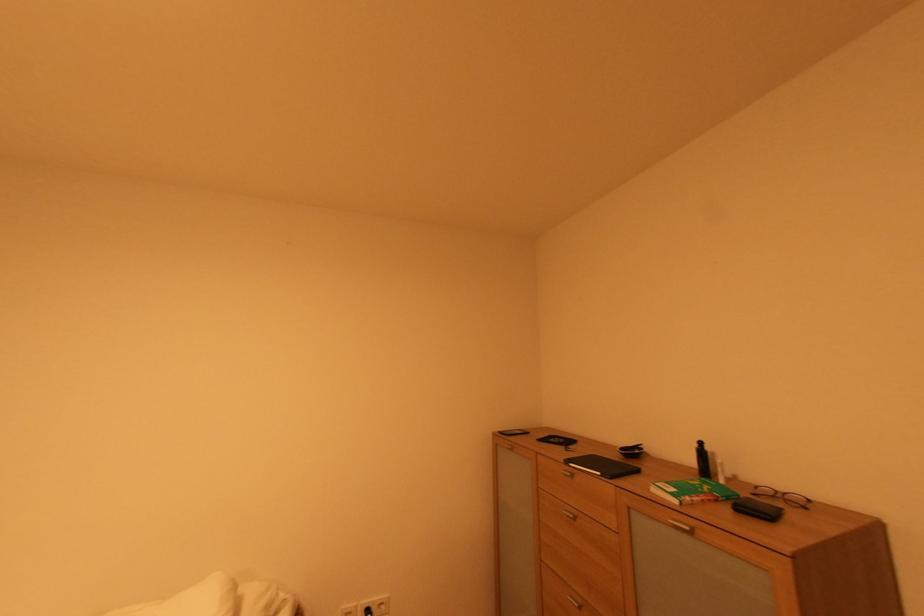
Identify the location of black glasses case. (758, 509).